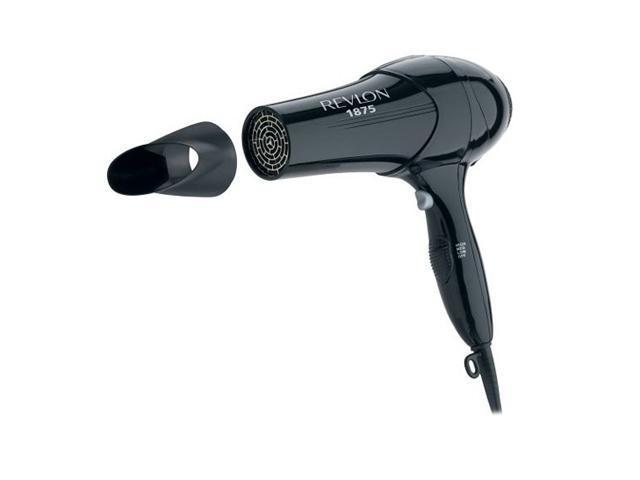
In order to click on power cord in this screenshot , I will do `click(486, 374)`.